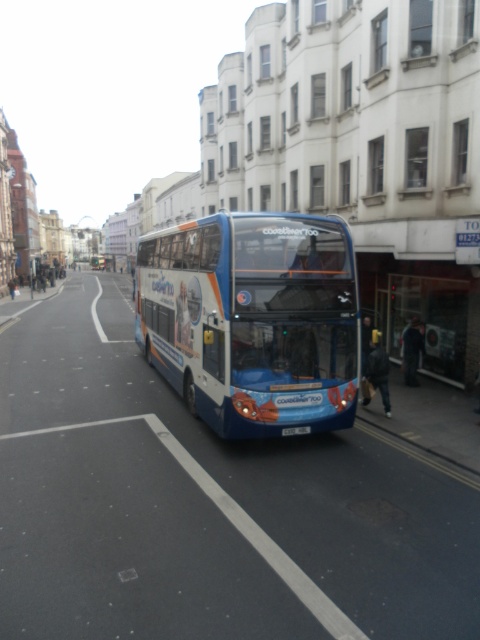
Question: Which point is farther to the camera?

Choices:
 (A) blue plastic license plate at center
 (B) blue matte/decorative bus at center

Answer: (A)

Question: Is blue matte/decorative bus at center smaller than blue plastic license plate at center?

Choices:
 (A) no
 (B) yes

Answer: (A)

Question: Is blue matte/decorative bus at center smaller than blue plastic license plate at center?

Choices:
 (A) no
 (B) yes

Answer: (A)

Question: Which of the following is the closest to the observer?

Choices:
 (A) (260, 310)
 (B) (308, 432)

Answer: (A)

Question: Is blue matte/decorative bus at center to the right of blue plastic license plate at center from the viewer's perspective?

Choices:
 (A) no
 (B) yes

Answer: (A)